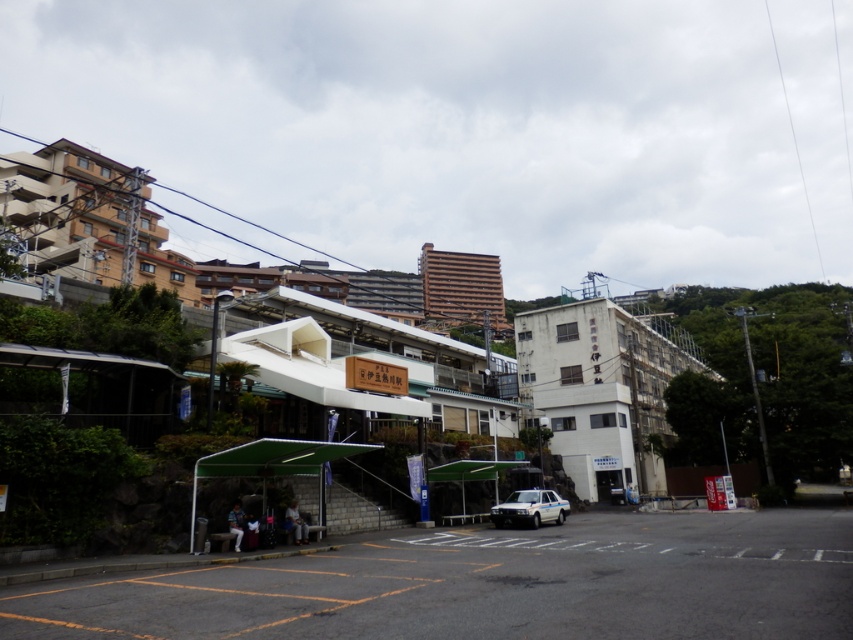
Looking at this image, you are a delivery person who needs to load a package onto the white glossy sedan at center. The package is taller than the blue denim jeans at lower left. Can the package fit in the sedan?

The white glossy sedan at center is taller than the blue denim jeans at lower left. Since the package is taller than the blue denim jeans at lower left, it might still fit in the sedan as the sedan is taller than the jeans. However, without knowing the exact height of the package relative to the sedan, we cannot be certain. Please measure the package height against the sedan directly.

You are a pedestrian standing at the entrance of the station and want to retrieve your dark blue fabric jacket at lower center. However, there is a white glossy sedan at center blocking your path. Which direction should you move to avoid the car?

You should move to the left to avoid the white glossy sedan at center since it is to the right of the dark blue fabric jacket at lower center.

You are a traveler who just arrived at the train station and is looking for your luggage. You notice a dark blue fabric jacket at lower center and blue denim jeans at lower left. Which item is closer to the ground?

The dark blue fabric jacket at lower center is below blue denim jeans at lower left, so the jacket is closer to the ground.